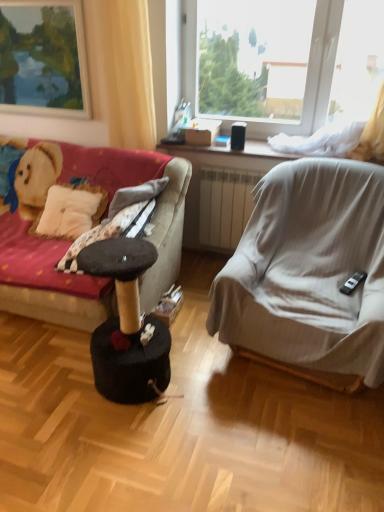
This screenshot has height=512, width=384. Find the location of `vacant space in between light gray fabric chair at right and black felt cat tree at center`. vacant space in between light gray fabric chair at right and black felt cat tree at center is located at coordinates (231, 383).